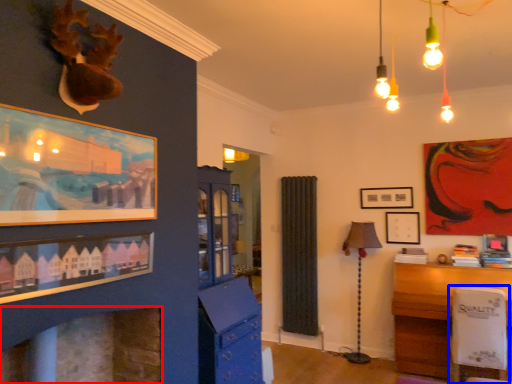
Question: Which object appears farthest to the camera in this image, fireplace (highlighted by a red box) or swivel chair (highlighted by a blue box)?

Choices:
 (A) fireplace
 (B) swivel chair

Answer: (B)